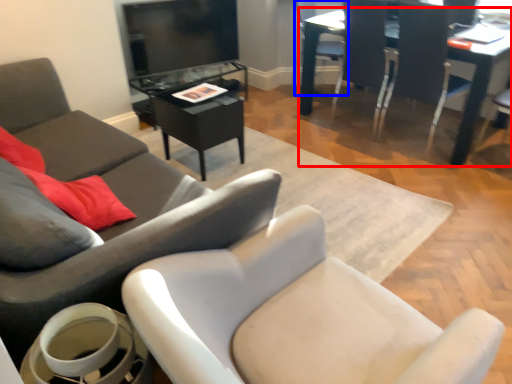
Question: Which point is closer to the camera, table (highlighted by a red box) or chair (highlighted by a blue box)?

Choices:
 (A) table
 (B) chair

Answer: (A)